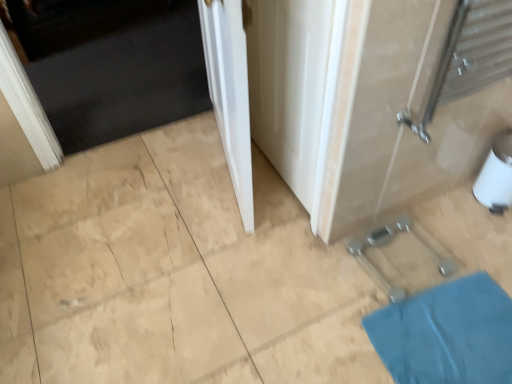
Question: In terms of height, does white smooth door at center, the 1th door positioned from the front, look taller or shorter compared to white glossy door at upper left, which ranks as the second door in right-to-left order?

Choices:
 (A) tall
 (B) short

Answer: (A)

Question: From the image's perspective, relative to white glossy door at upper left, which ranks as the second door in right-to-left order, is white smooth door at center, the 1th door positioned from the front, above or below?

Choices:
 (A) below
 (B) above

Answer: (A)

Question: Which is nearer to the white glossy door at upper left, acting as the second door starting from the front?

Choices:
 (A) white smooth door at center, the 1th door positioned from the front
 (B) white glossy door at center
 (C) blue fabric bath mat at lower right

Answer: (A)

Question: Based on their relative distances, which object is farther from the white glossy door at upper left, which is counted as the first door, starting from the left?

Choices:
 (A) white glossy door at center
 (B) white smooth door at center, the 2th door in the back-to-front sequence
 (C) blue fabric bath mat at lower right

Answer: (C)